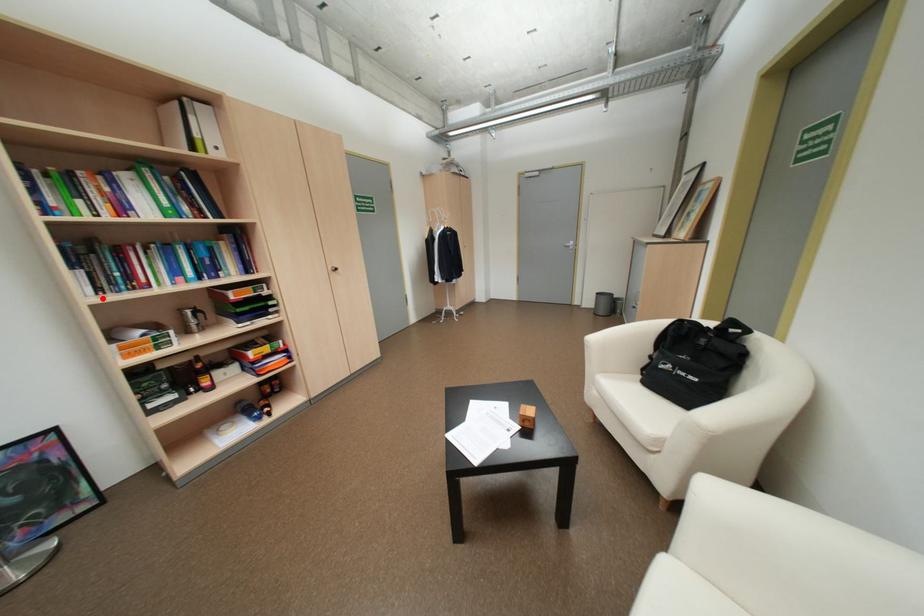
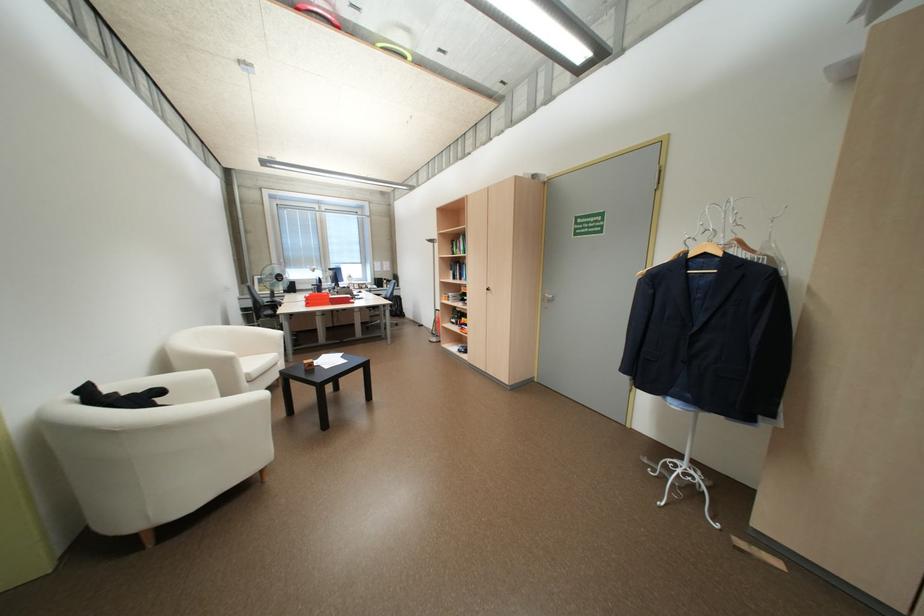
Where in the second image is the point corresponding to the highlighted location from the first image?

(460, 280)